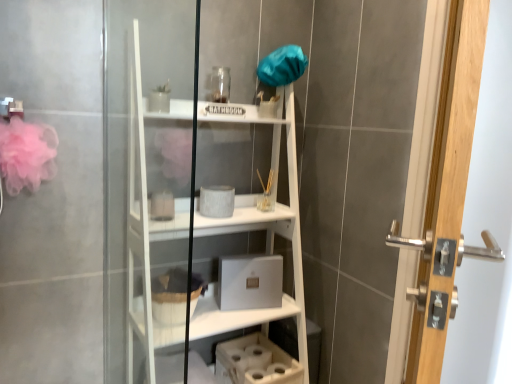
Question: From a real-world perspective, is fuzzy fabric basket at lower center positioned under polished silver handle at right based on gravity?

Choices:
 (A) no
 (B) yes

Answer: (B)

Question: Does fuzzy fabric basket at lower center have a greater width compared to polished silver handle at right?

Choices:
 (A) yes
 (B) no

Answer: (A)

Question: Does fuzzy fabric basket at lower center have a lesser width compared to polished silver handle at right?

Choices:
 (A) yes
 (B) no

Answer: (B)

Question: Is fuzzy fabric basket at lower center smaller than polished silver handle at right?

Choices:
 (A) no
 (B) yes

Answer: (B)

Question: Considering the relative sizes of fuzzy fabric basket at lower center and polished silver handle at right in the image provided, is fuzzy fabric basket at lower center taller than polished silver handle at right?

Choices:
 (A) no
 (B) yes

Answer: (A)

Question: Is fuzzy fabric basket at lower center turned away from polished silver handle at right?

Choices:
 (A) no
 (B) yes

Answer: (A)

Question: Considering the relative sizes of polished silver handle at right and white matte bookshelf at center in the image provided, is polished silver handle at right shorter than white matte bookshelf at center?

Choices:
 (A) no
 (B) yes

Answer: (B)

Question: Would you say polished silver handle at right contains white matte bookshelf at center?

Choices:
 (A) yes
 (B) no

Answer: (B)

Question: Is polished silver handle at right closer to the viewer compared to white matte bookshelf at center?

Choices:
 (A) yes
 (B) no

Answer: (A)

Question: Could you tell me if polished silver handle at right is turned towards white matte bookshelf at center?

Choices:
 (A) yes
 (B) no

Answer: (B)

Question: Can you confirm if polished silver handle at right is thinner than white matte bookshelf at center?

Choices:
 (A) no
 (B) yes

Answer: (B)

Question: Is polished silver handle at right turned away from white matte bookshelf at center?

Choices:
 (A) no
 (B) yes

Answer: (B)

Question: Considering the relative sizes of white matte bookshelf at center and polished silver handle at right in the image provided, is white matte bookshelf at center wider than polished silver handle at right?

Choices:
 (A) no
 (B) yes

Answer: (B)